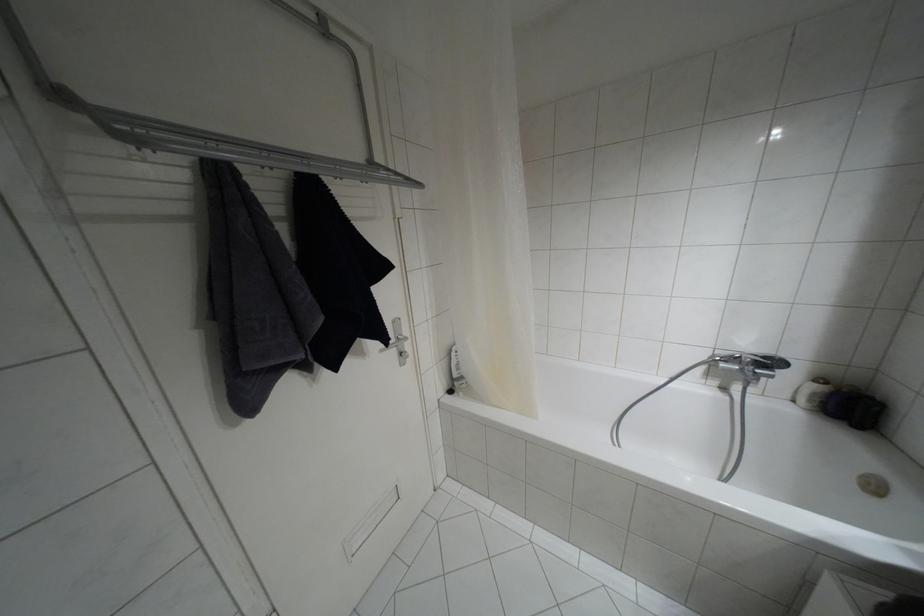
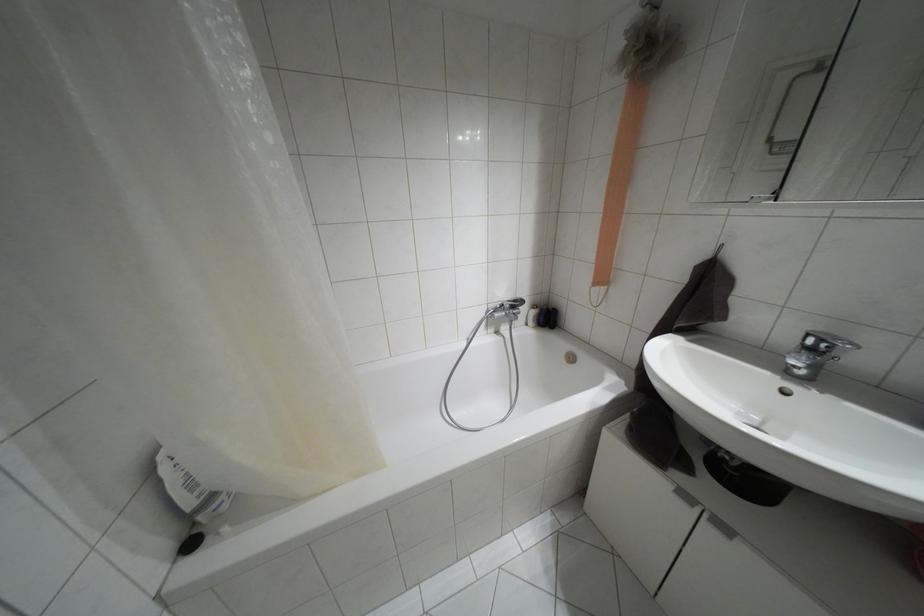
Locate, in the second image, the point that corresponds to (852,408) in the first image.

(546, 317)